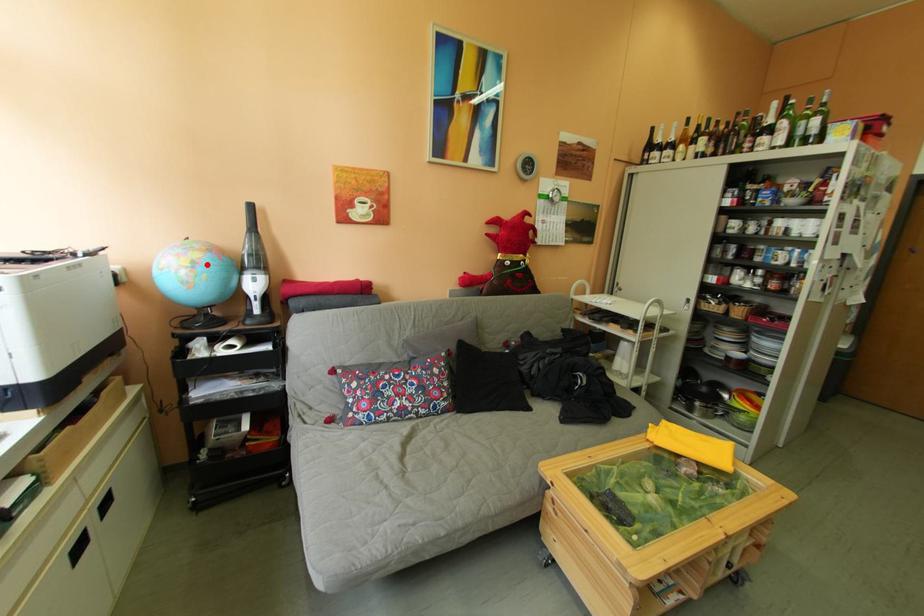
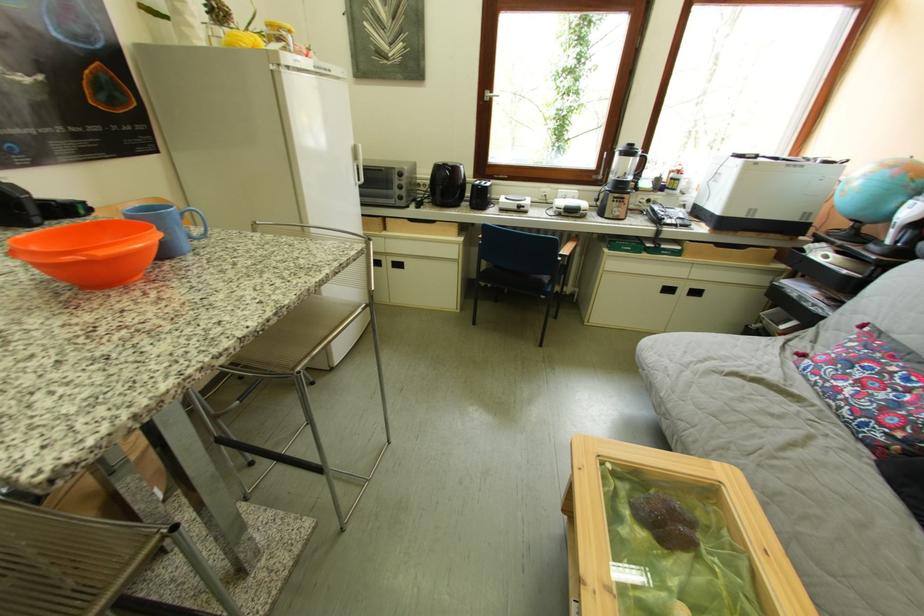
Question: I am providing you with two images of the same scene from different viewpoints. Image1 has a red point marked. In image2, the corresponding 3D location appears at what relative position? Reply with the corresponding letter.

Choices:
 (A) Closer
 (B) Farther

Answer: (B)